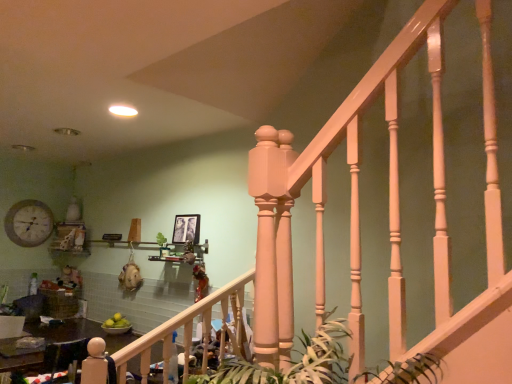
Question: Is point (315, 357) closer or farther from the camera than point (24, 213)?

Choices:
 (A) closer
 (B) farther

Answer: (A)

Question: In terms of width, does green leafy plant at center look wider or thinner when compared to matte white clock at upper left?

Choices:
 (A) thin
 (B) wide

Answer: (B)

Question: Which is nearer to the black matte picture frame at upper center?

Choices:
 (A) matte white railing at center
 (B) wooden table at lower left
 (C) matte white clock at upper left
 (D) green leafy plant at center

Answer: (A)

Question: Based on their relative distances, which object is nearer to the matte white clock at upper left?

Choices:
 (A) black matte picture frame at upper center
 (B) wooden table at lower left
 (C) matte white railing at center
 (D) green leafy plant at center

Answer: (B)